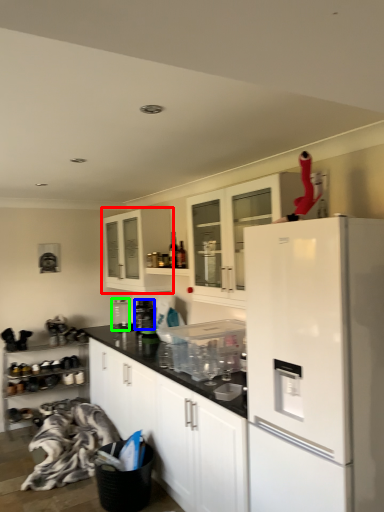
Question: Estimate the real-world distances between objects in this image. Which object is closer to cabinetry (highlighted by a red box), appliance (highlighted by a blue box) or appliance (highlighted by a green box)?

Choices:
 (A) appliance
 (B) appliance

Answer: (A)